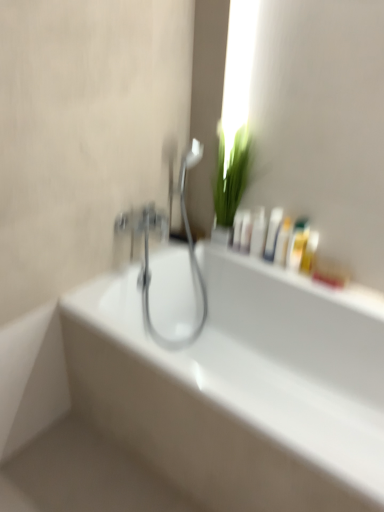
Question: Does white glossy bottles at upper center, placed as the 5th mouthwash when sorted from right to left, appear on the right side of yellow plastic bottle at upper right, arranged as the first mouthwash when viewed from the right?

Choices:
 (A) no
 (B) yes

Answer: (A)

Question: Is white glossy bottles at upper center, marked as the third mouthwash in a left-to-right arrangement, bigger than yellow plastic bottle at upper right, arranged as the first mouthwash when viewed from the right?

Choices:
 (A) no
 (B) yes

Answer: (B)

Question: From the image's perspective, is white glossy bottles at upper center, marked as the third mouthwash in a left-to-right arrangement, on top of yellow plastic bottle at upper right, arranged as the first mouthwash when viewed from the right?

Choices:
 (A) no
 (B) yes

Answer: (B)

Question: Is white glossy bottles at upper center, placed as the 5th mouthwash when sorted from right to left, to the left of yellow plastic bottle at upper right, arranged as the first mouthwash when viewed from the right, from the viewer's perspective?

Choices:
 (A) yes
 (B) no

Answer: (A)

Question: Is white glossy bottles at upper center, placed as the 5th mouthwash when sorted from right to left, oriented away from yellow plastic bottle at upper right, arranged as the first mouthwash when viewed from the right?

Choices:
 (A) no
 (B) yes

Answer: (A)

Question: Is white glossy bottles at upper center, marked as the third mouthwash in a left-to-right arrangement, not within yellow plastic bottle at upper right, arranged as the first mouthwash when viewed from the right?

Choices:
 (A) no
 (B) yes

Answer: (B)

Question: Would you say white glossy bottles at upper center contains yellow plastic bottle at upper right, which is counted as the 7th mouthwash, starting from the left?

Choices:
 (A) no
 (B) yes

Answer: (A)

Question: Is white glossy bottles at upper center smaller than yellow plastic bottle at upper right, arranged as the first mouthwash when viewed from the right?

Choices:
 (A) no
 (B) yes

Answer: (A)

Question: From a real-world perspective, is white glossy bottles at upper center on yellow plastic bottle at upper right, which is counted as the 7th mouthwash, starting from the left?

Choices:
 (A) no
 (B) yes

Answer: (A)

Question: Is white glossy bottles at upper center wider than yellow plastic bottle at upper right, arranged as the first mouthwash when viewed from the right?

Choices:
 (A) no
 (B) yes

Answer: (B)

Question: Does white glossy bottles at upper center lie behind yellow plastic bottle at upper right, arranged as the first mouthwash when viewed from the right?

Choices:
 (A) yes
 (B) no

Answer: (B)

Question: Is white glossy bottles at upper center positioned with its back to yellow plastic bottle at upper right, which is counted as the 7th mouthwash, starting from the left?

Choices:
 (A) yes
 (B) no

Answer: (B)

Question: From a real-world perspective, is white glossy bathtub at center on top of white glossy bottle at upper right, which is counted as the seventh mouthwash, starting from the right?

Choices:
 (A) no
 (B) yes

Answer: (A)